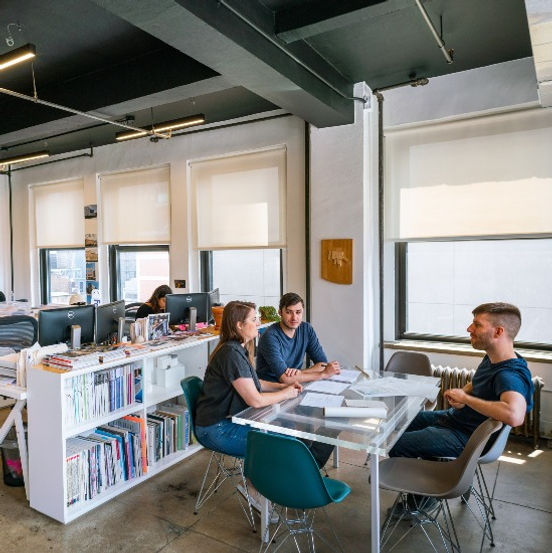
Find the location of a particular element. The image size is (552, 553). monitor is located at coordinates (76, 318), (111, 317), (185, 305), (215, 297).